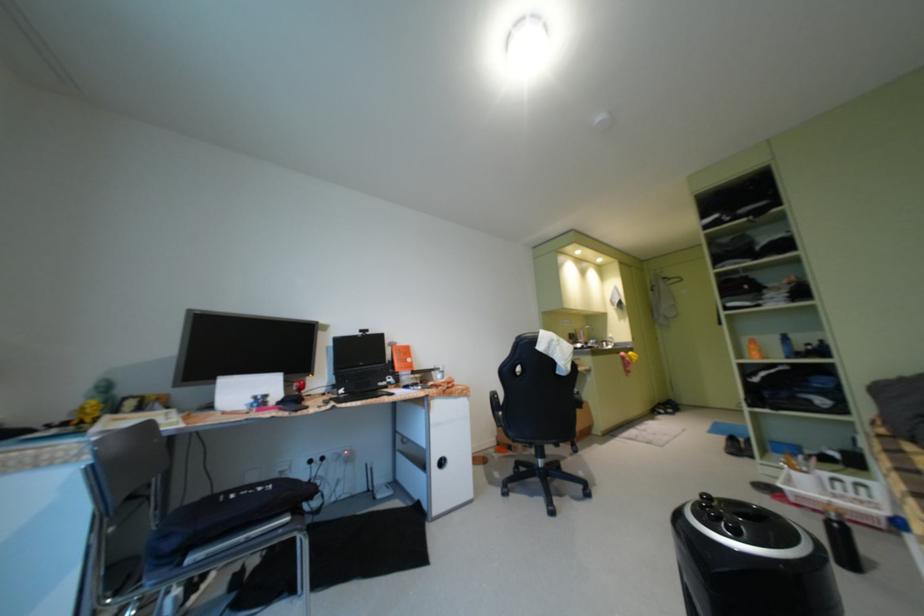
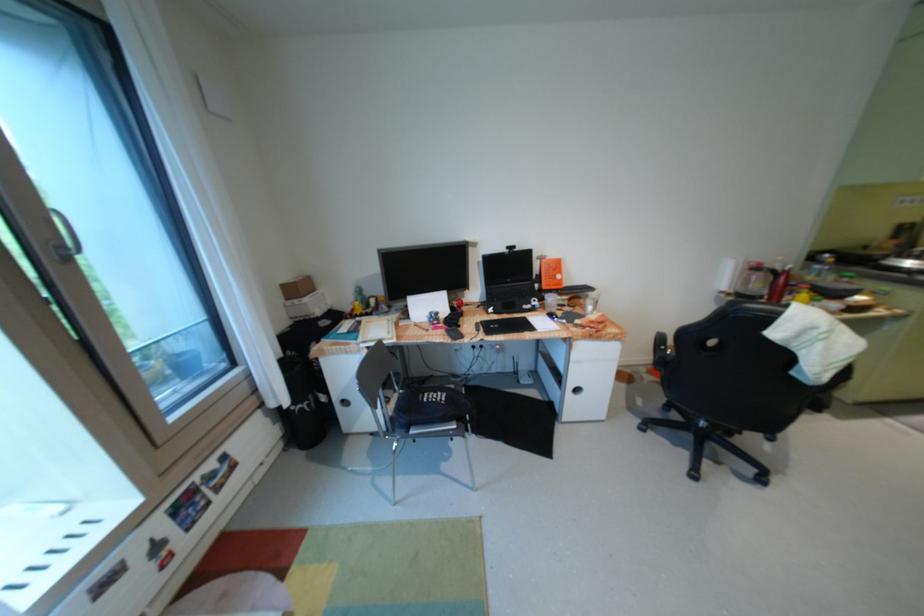
In the second image, find the point that corresponds to the point at 271,402 in the first image.

(444, 318)